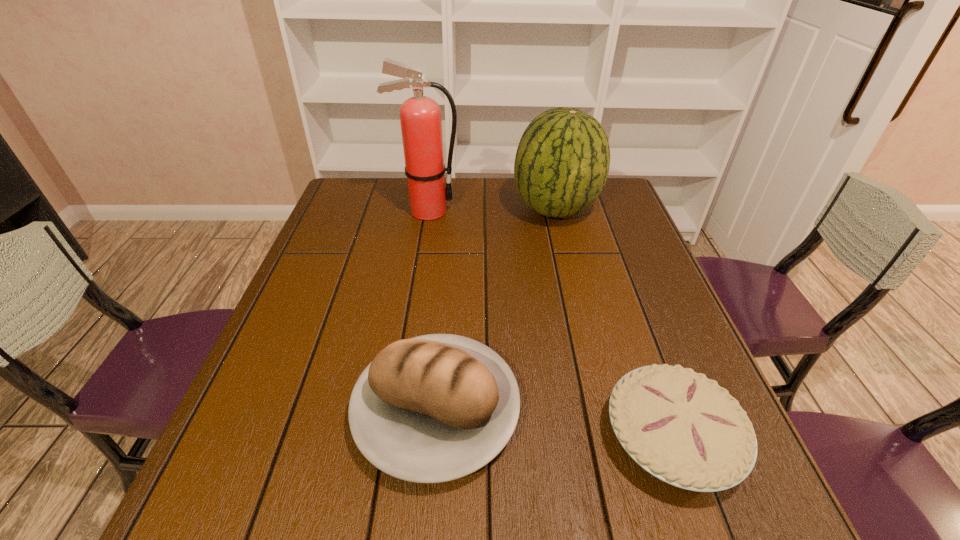
Where is `vacant space at the far left corner`? This screenshot has width=960, height=540. vacant space at the far left corner is located at coordinates (355, 188).

Find the location of a particular element. This screenshot has width=960, height=540. blank area at the near left corner is located at coordinates (228, 532).

Locate an element on the screen. This screenshot has height=540, width=960. vacant area that lies between the tallest object and the third shortest object is located at coordinates (492, 210).

The image size is (960, 540). Find the location of `unoccupied area between the shortest object and the bread`. unoccupied area between the shortest object and the bread is located at coordinates (554, 423).

Where is `unoccupied area between the bread and the pie`? This screenshot has height=540, width=960. unoccupied area between the bread and the pie is located at coordinates (554, 423).

Locate an element on the screen. unoccupied position between the fire extinguisher and the shortest object is located at coordinates (550, 324).

I want to click on vacant point located between the fire extinguisher and the pie, so click(550, 324).

Where is `free point between the watermelon and the bread`? This screenshot has height=540, width=960. free point between the watermelon and the bread is located at coordinates (496, 310).

Find the location of a particular element. The width and height of the screenshot is (960, 540). vacant space in between the second shortest object and the fire extinguisher is located at coordinates (432, 310).

This screenshot has width=960, height=540. I want to click on free space between the pie and the third tallest object, so click(554, 423).